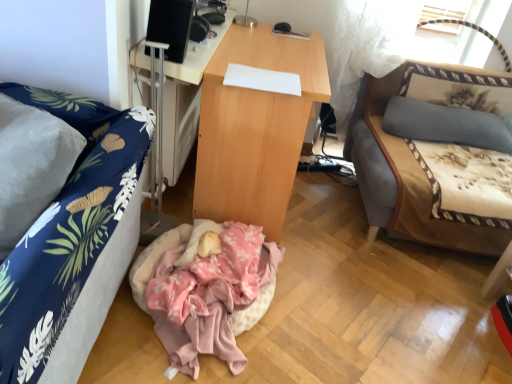
Identify the location of blank space situated above gray fabric pillow at right (from a real-world perspective). Image resolution: width=512 pixels, height=384 pixels. (452, 109).